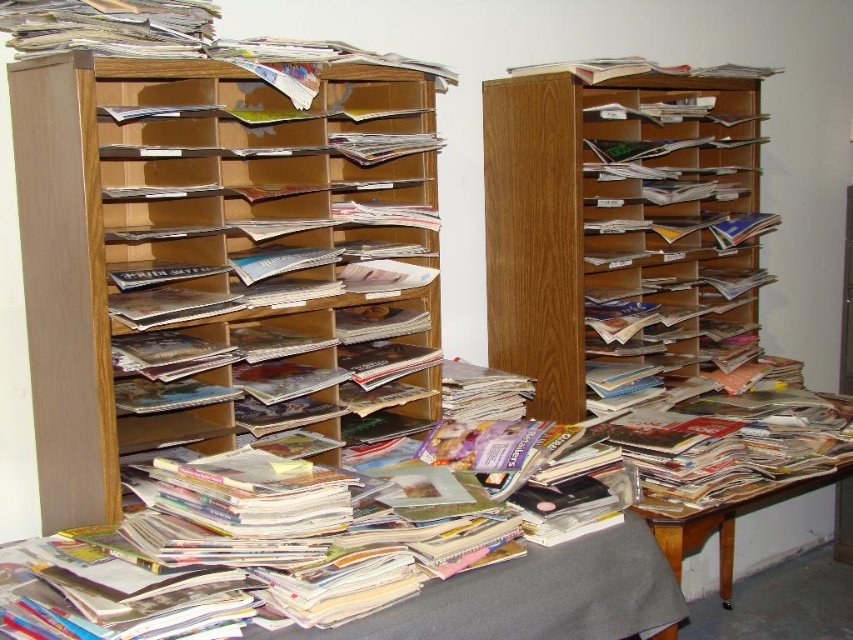
Is point (138, 333) closer to camera compared to point (698, 330)?

Yes, point (138, 333) is closer to viewer.

At what (x,y) coordinates should I click in order to perform the action: click on wooden magazine rack at left. Please return your answer as a coordinate pair (x, y). Looking at the image, I should click on (216, 259).

Who is more forward, (670, 221) or (581, 589)?

Point (581, 589)

Which is more to the left, wooden bookshelf at center or gray fabric at lower center?

gray fabric at lower center

Is point (636, 378) closer to camera compared to point (604, 564)?

That is False.

The width and height of the screenshot is (853, 640). In order to click on wooden bookshelf at center in this screenshot , I will do `click(621, 228)`.

Does gray fabric at lower center have a greater width compared to matte paper magazine at center?

Yes.

Who is more forward, [561,570] or [271,268]?

Point [561,570]

Image resolution: width=853 pixels, height=640 pixels. I want to click on gray fabric at lower center, so click(572, 589).